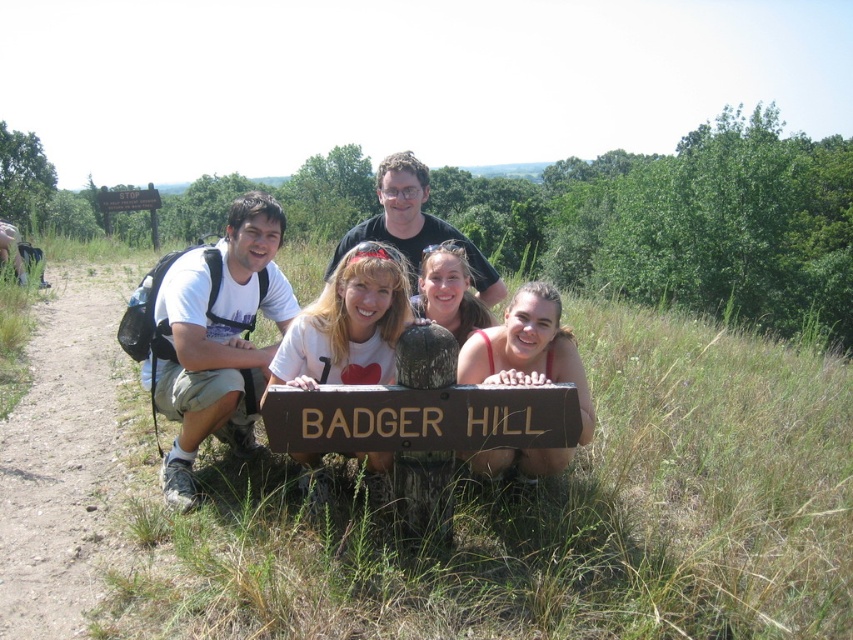
You are a photographer trying to ensure all subjects are visible in the photo. Given that the white matte shirt at center and the smooth tan skin at center are both at the center, which one is smaller in size?

The white matte shirt at center occupies less space than smooth tan skin at center, so the white matte shirt at center is smaller in size.